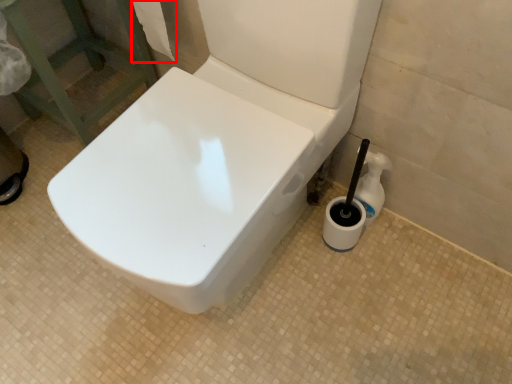
Question: Considering the relative positions of toilet paper (annotated by the red box) and cleaning product in the image provided, where is toilet paper (annotated by the red box) located with respect to the staircase?

Choices:
 (A) left
 (B) right

Answer: (A)